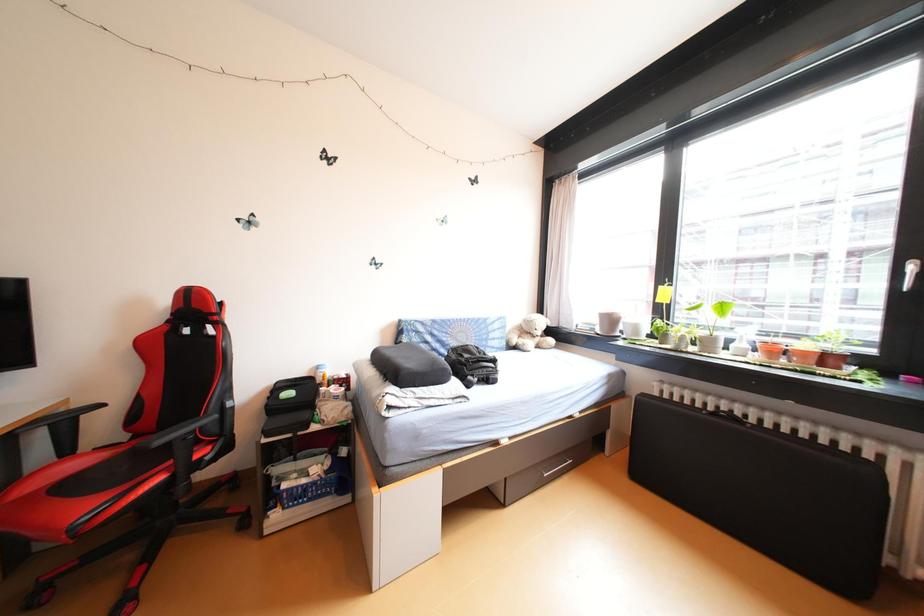
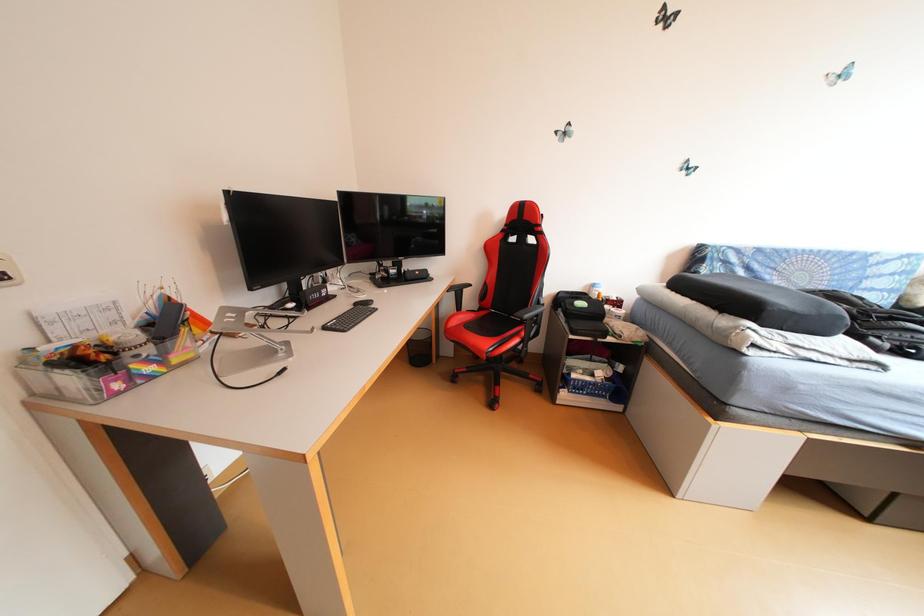
How did the camera likely rotate?

The camera's rotation is toward left-down.